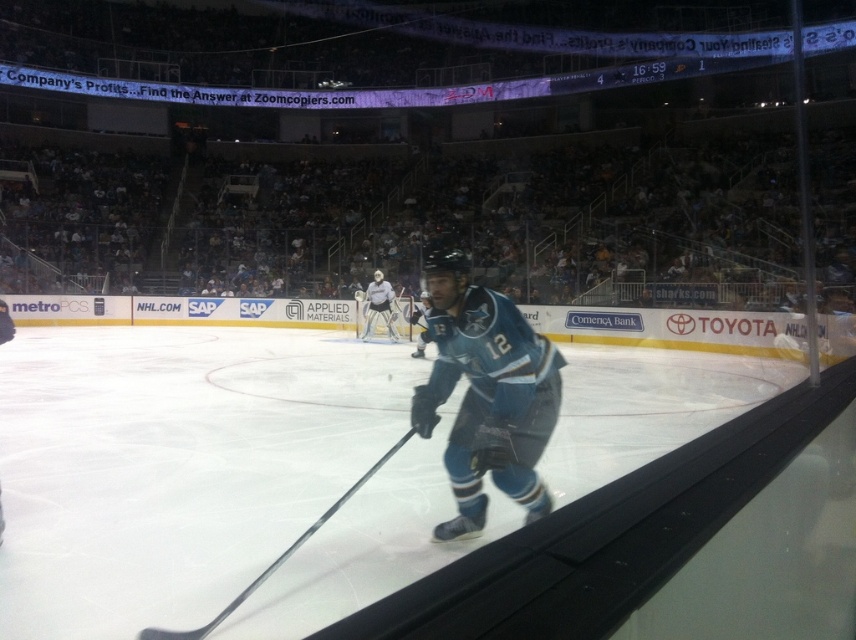
Looking at this image, you are a hockey player standing at the center of the ice rink. You need to locate the metallic silver hockey stick at center. Based on the coordinates provided, in which direction should you move to reach it?

The metallic silver hockey stick at center is located at coordinates point (274, 560). Since you are at the center of the ice rink, which is typically at coordinates (428, 320), you should move northeast to reach it.